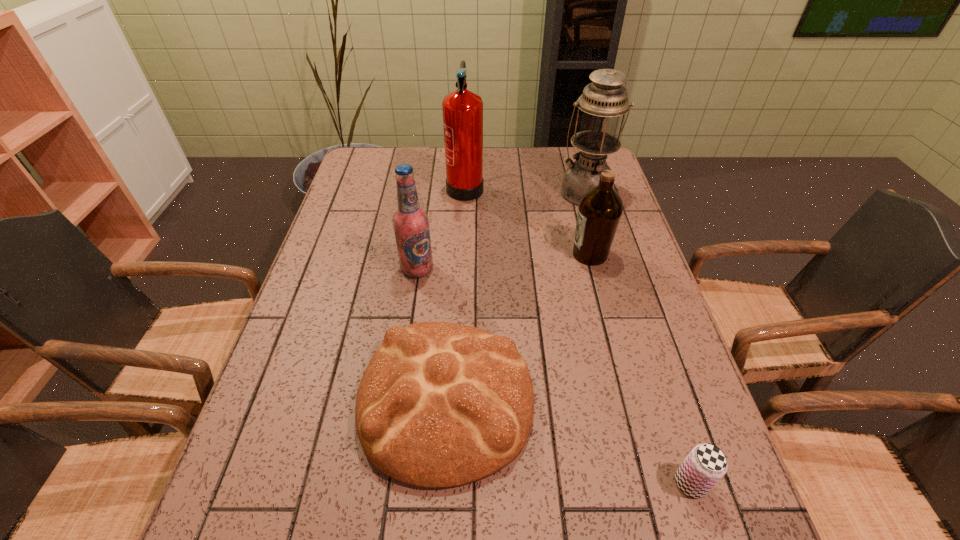
Find the location of `vacant area situated on the label of the fourth tallest object`. vacant area situated on the label of the fourth tallest object is located at coordinates (524, 254).

Find the location of `free location located on the label of the fourth tallest object`. free location located on the label of the fourth tallest object is located at coordinates (449, 254).

Where is `vacant space located 0.200m on the back of the second shortest object`? Image resolution: width=960 pixels, height=540 pixels. vacant space located 0.200m on the back of the second shortest object is located at coordinates (454, 271).

Where is `free space located 0.210m on the back of the shortest object`? The width and height of the screenshot is (960, 540). free space located 0.210m on the back of the shortest object is located at coordinates (654, 370).

Locate an element on the screen. fire extinguisher that is at the far edge is located at coordinates click(462, 109).

Identify the location of oil lamp situated at the far edge. Image resolution: width=960 pixels, height=540 pixels. (603, 101).

Identify the location of oil lamp that is at the right edge. Image resolution: width=960 pixels, height=540 pixels. (603, 101).

Image resolution: width=960 pixels, height=540 pixels. I want to click on olive oil that is at the right edge, so click(x=600, y=209).

Find the location of a particular element. beer can located at the right edge is located at coordinates (706, 464).

Locate an element on the screen. This screenshot has width=960, height=540. object located in the far right corner section of the desktop is located at coordinates (603, 101).